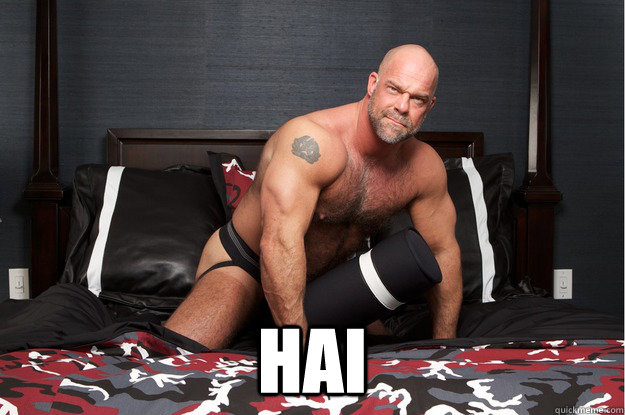
The height and width of the screenshot is (415, 625). Identify the location of wall. (286, 68).